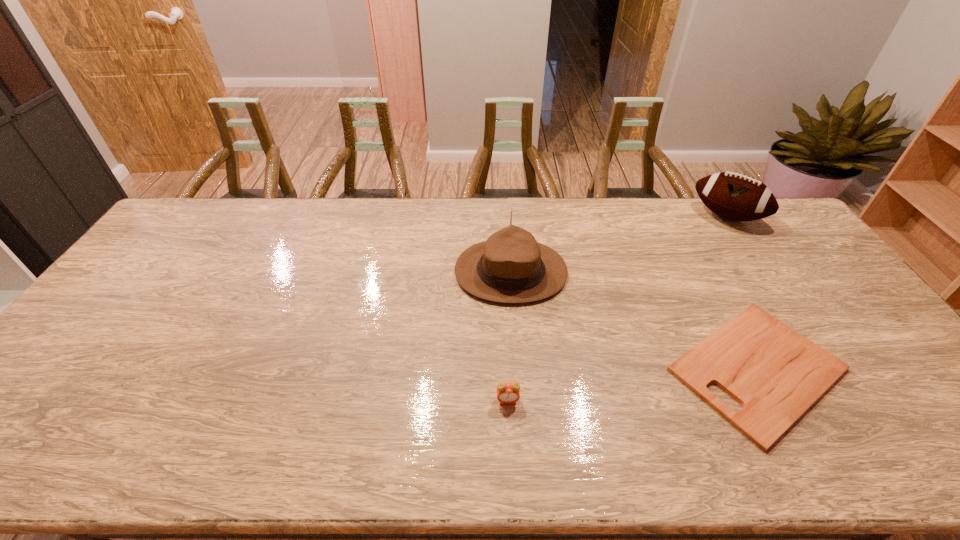
Find the location of a particular element. the farthest object is located at coordinates (734, 196).

The image size is (960, 540). In order to click on the third nearest object in this screenshot , I will do `click(510, 266)`.

I want to click on alarm clock, so click(507, 393).

Identify the location of the shortest object. (776, 374).

Image resolution: width=960 pixels, height=540 pixels. Find the location of `vacant area situated on the front of the farthest object`. vacant area situated on the front of the farthest object is located at coordinates pos(792,314).

You are a GUI agent. You are given a task and a screenshot of the screen. Output one action in this format:
    pyautogui.click(x=<x>, y=<y>)
    Task: Click on the vacant point located 0.200m on the feather side of the fedora
    Image resolution: width=960 pixels, height=540 pixels.
    Given the screenshot: What is the action you would take?
    pyautogui.click(x=391, y=272)

You are a GUI agent. You are given a task and a screenshot of the screen. Output one action in this format:
    pyautogui.click(x=<x>, y=<y>)
    Task: Click on the free region located 0.190m on the feather side of the fedora
    The height and width of the screenshot is (540, 960).
    Given the screenshot: What is the action you would take?
    pyautogui.click(x=395, y=272)

Where is `vacant space situated 0.210m on the feather side of the fedora`? vacant space situated 0.210m on the feather side of the fedora is located at coordinates (388, 272).

This screenshot has width=960, height=540. What are the coordinates of `vacant region located on the face of the alarm clock` in the screenshot? It's located at (509, 425).

This screenshot has height=540, width=960. I want to click on vacant space located 0.180m on the left of the shortest object, so click(596, 369).